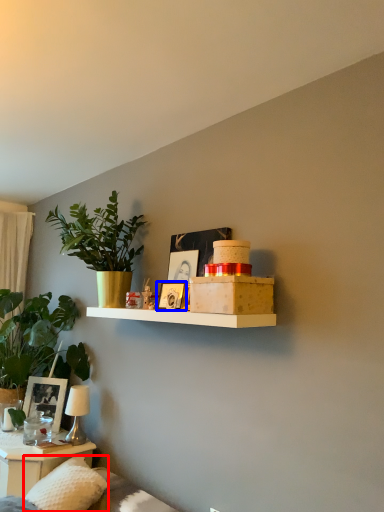
Question: Among these objects, which one is nearest to the camera, pillow (highlighted by a red box) or picture frame (highlighted by a blue box)?

Choices:
 (A) pillow
 (B) picture frame

Answer: (A)